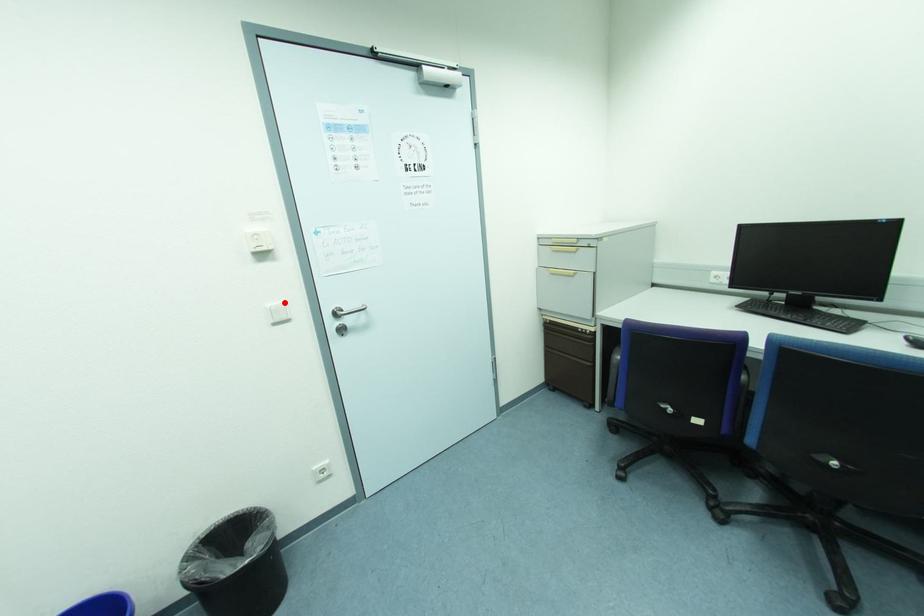
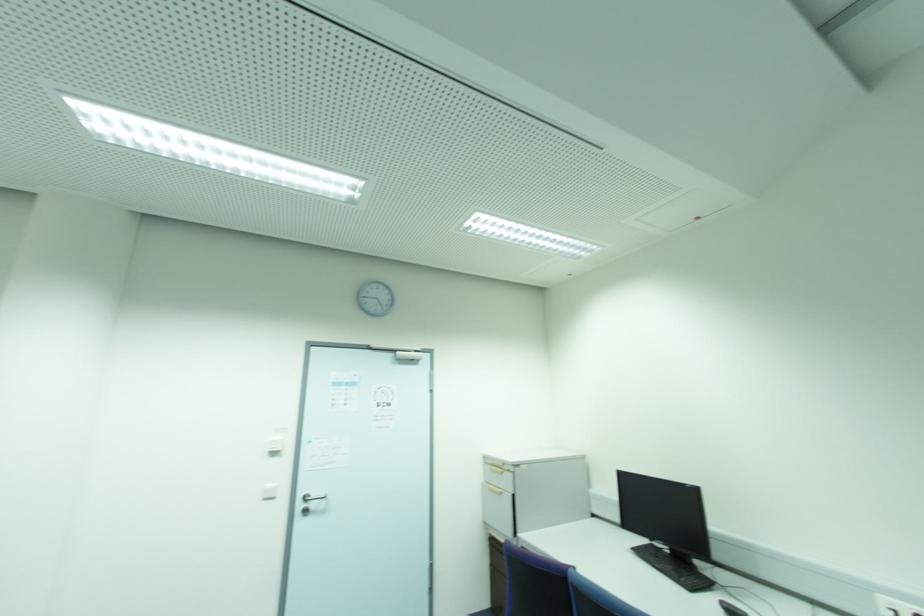
The point at the highlighted location is marked in the first image. Where is the corresponding point in the second image?

(274, 485)